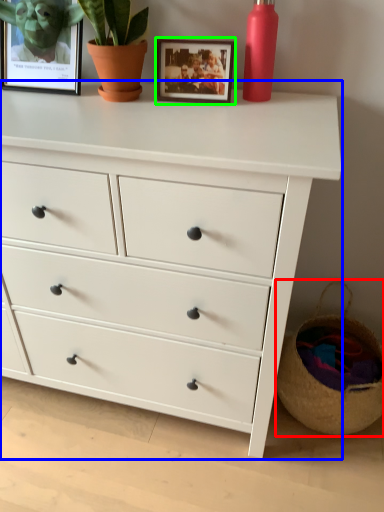
Question: Based on their relative distances, which object is farther from basket (highlighted by a red box)? Choose from chest of drawers (highlighted by a blue box) and picture frame (highlighted by a green box).

Choices:
 (A) chest of drawers
 (B) picture frame

Answer: (B)